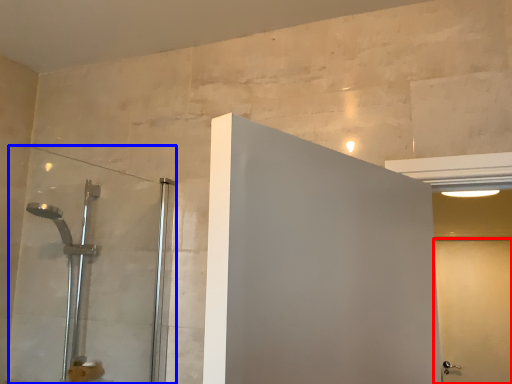
Question: Which object appears closest to the camera in this image, screen door (highlighted by a red box) or shower door (highlighted by a blue box)?

Choices:
 (A) screen door
 (B) shower door

Answer: (B)